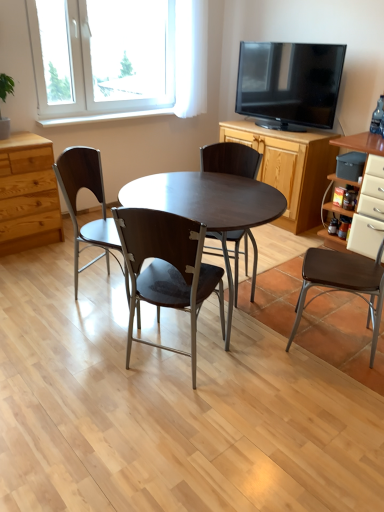
Locate an element on the screen. free spot in front of light brown wood chest of drawers at left is located at coordinates point(28,265).